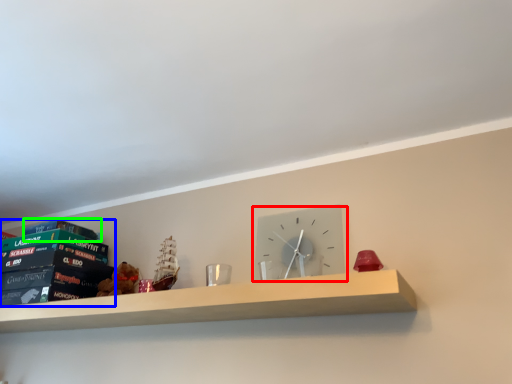
Question: Which object is positioned farthest from wall clock (highlighted by a red box)? Select from paperback book (highlighted by a blue box) and paperback book (highlighted by a green box).

Choices:
 (A) paperback book
 (B) paperback book

Answer: (B)